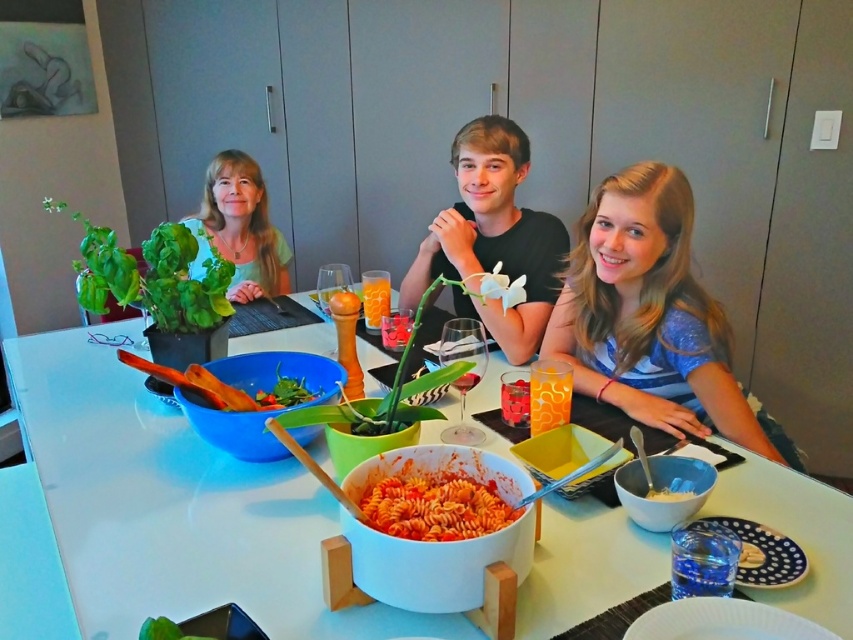
Between blue striped shirt at center and green matte shirt at upper left, which one has less height?

green matte shirt at upper left is shorter.

From the picture: Is blue striped shirt at center bigger than green matte shirt at upper left?

Correct, blue striped shirt at center is larger in size than green matte shirt at upper left.

Between point (567, 362) and point (274, 227), which one is positioned in front?

Positioned in front is point (567, 362).

This screenshot has height=640, width=853. Identify the location of blue striped shirt at center. (653, 317).

Which is more to the left, white glossy table at center or black matte shirt at center?

white glossy table at center

Between white glossy table at center and black matte shirt at center, which one is positioned higher?

black matte shirt at center

Does point (228, 579) come in front of point (525, 323)?

Yes, point (228, 579) is closer to viewer.

At what (x,y) coordinates should I click in order to perform the action: click on white glossy table at center. Please return your answer as a coordinate pair (x, y). This screenshot has height=640, width=853. Looking at the image, I should click on (175, 508).

Which of these two, black matte shirt at center or green matte shirt at upper left, stands shorter?

With less height is green matte shirt at upper left.

Can you confirm if black matte shirt at center is positioned below green matte shirt at upper left?

Yes, black matte shirt at center is below green matte shirt at upper left.

The width and height of the screenshot is (853, 640). Identify the location of black matte shirt at center. (492, 237).

Locate an element on the screen. black matte shirt at center is located at coordinates (492, 237).